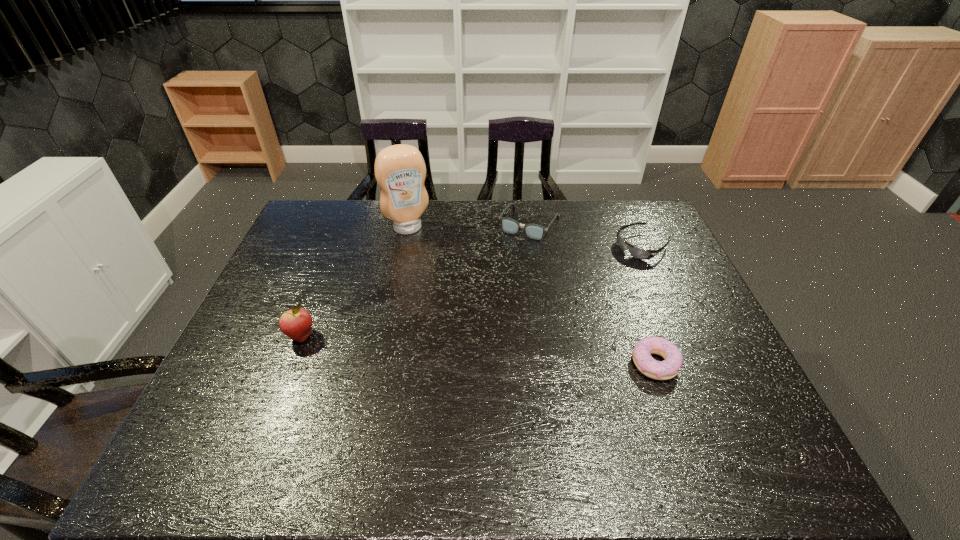
Locate an element on the screen. This screenshot has width=960, height=540. vacant space at the far left corner of the desktop is located at coordinates (352, 204).

The width and height of the screenshot is (960, 540). In order to click on vacant space at the far right corner of the desktop in this screenshot , I will do `click(665, 229)`.

Image resolution: width=960 pixels, height=540 pixels. Identify the location of vacant region between the third tallest object and the doughnut. (592, 293).

Identify the location of vacant area between the doughnut and the third object from right to left. (592, 293).

The height and width of the screenshot is (540, 960). I want to click on free space between the doughnut and the fourth object from right to left, so click(x=532, y=295).

Find the location of a particular element. The image size is (960, 540). vacant area that lies between the fourth shortest object and the third shortest object is located at coordinates (416, 280).

Identify the location of free space between the tallest object and the fourth shortest object. This screenshot has height=540, width=960. (355, 282).

This screenshot has height=540, width=960. I want to click on empty space that is in between the third shortest object and the fourth shortest object, so click(x=416, y=280).

Locate an element on the screen. free area in between the third object from right to left and the tallest object is located at coordinates (468, 226).

In order to click on vacant area that lies between the sunglasses and the third object from left to right in this screenshot , I will do `click(586, 235)`.